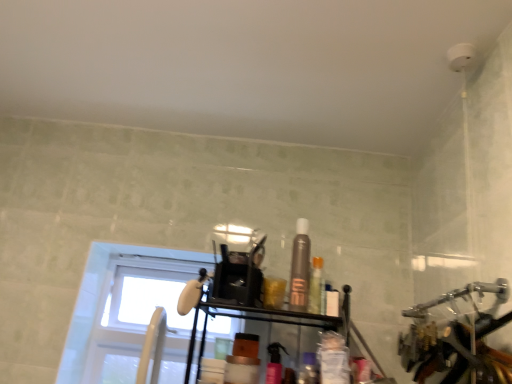
Question: Is satin brown spray can at center, the third toiletry positioned from the right, to the left of pink glossy spray can at center, the fourth toiletry when ordered from right to left, from the viewer's perspective?

Choices:
 (A) yes
 (B) no

Answer: (B)

Question: Is satin brown spray can at center, the third toiletry positioned from the right, closer to camera compared to pink glossy spray can at center, which ranks as the first toiletry in left-to-right order?

Choices:
 (A) no
 (B) yes

Answer: (A)

Question: Does satin brown spray can at center, the third toiletry positioned from the right, have a larger size compared to pink glossy spray can at center, the fourth toiletry when ordered from right to left?

Choices:
 (A) no
 (B) yes

Answer: (B)

Question: Can you confirm if satin brown spray can at center, the 2th toiletry in the left-to-right sequence, is shorter than pink glossy spray can at center, which ranks as the first toiletry in left-to-right order?

Choices:
 (A) yes
 (B) no

Answer: (B)

Question: Considering the relative sizes of satin brown spray can at center, the 2th toiletry in the left-to-right sequence, and pink glossy spray can at center, which ranks as the first toiletry in left-to-right order, in the image provided, is satin brown spray can at center, the 2th toiletry in the left-to-right sequence, thinner than pink glossy spray can at center, which ranks as the first toiletry in left-to-right order,?

Choices:
 (A) yes
 (B) no

Answer: (A)

Question: Considering the positions of point (303, 369) and point (83, 347), is point (303, 369) closer or farther from the camera than point (83, 347)?

Choices:
 (A) closer
 (B) farther

Answer: (A)

Question: In the image, is translucent plastic container at center, the 2th toiletry viewed from the right, positioned in front of or behind white glass window at upper left?

Choices:
 (A) behind
 (B) front

Answer: (B)

Question: From the image's perspective, is translucent plastic container at center, which is the 3th toiletry in left-to-right order, positioned above or below white glass window at upper left?

Choices:
 (A) above
 (B) below

Answer: (A)

Question: Would you say translucent plastic container at center, the 2th toiletry viewed from the right, is to the left or to the right of white glass window at upper left in the picture?

Choices:
 (A) left
 (B) right

Answer: (B)

Question: From the image's perspective, is pink glossy spray can at center, which ranks as the first toiletry in left-to-right order, positioned above or below translucent plastic bottle at center, which appears as the first toiletry when viewed from the right?

Choices:
 (A) above
 (B) below

Answer: (B)

Question: Considering the positions of point (267, 367) and point (310, 278), is point (267, 367) closer or farther from the camera than point (310, 278)?

Choices:
 (A) farther
 (B) closer

Answer: (B)

Question: In terms of size, does pink glossy spray can at center, which ranks as the first toiletry in left-to-right order, appear bigger or smaller than translucent plastic bottle at center, the 4th toiletry viewed from the left?

Choices:
 (A) big
 (B) small

Answer: (B)

Question: Looking at their shapes, would you say pink glossy spray can at center, the fourth toiletry when ordered from right to left, is wider or thinner than translucent plastic bottle at center, the 4th toiletry viewed from the left?

Choices:
 (A) wide
 (B) thin

Answer: (B)

Question: In the image, is white glass window at upper left positioned in front of or behind satin brown spray can at center, the third toiletry positioned from the right?

Choices:
 (A) front
 (B) behind

Answer: (B)

Question: From a real-world perspective, is white glass window at upper left positioned above or below satin brown spray can at center, the 2th toiletry in the left-to-right sequence?

Choices:
 (A) above
 (B) below

Answer: (B)